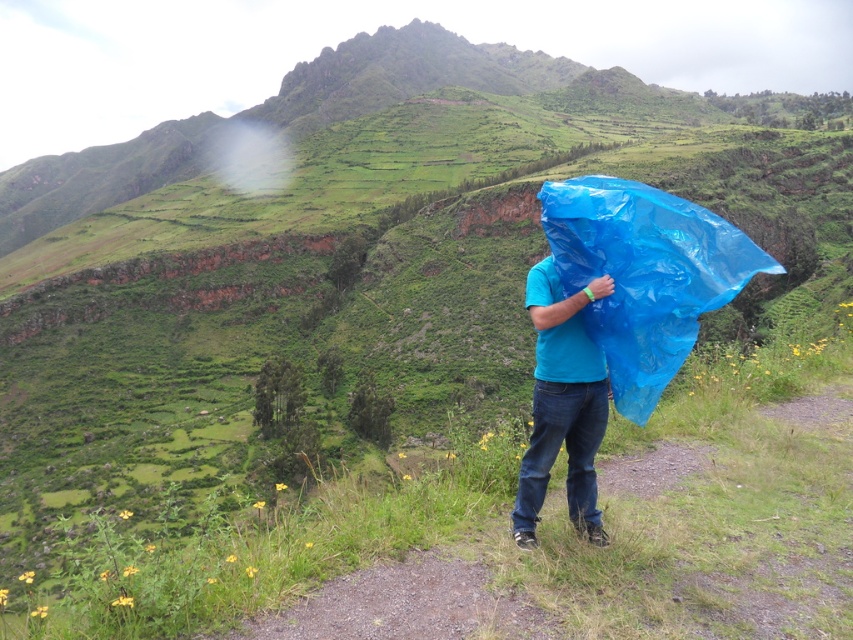
You are standing at the point marked by coordinates point (643,275). What object is located at this point?

The point (643,275) marks the blue plastic bag at center.

You are a photographer trying to capture the scenic outdoor setting. You notice the blue plastic bag at center and the blue matte plastic bag at center in the image. Which one is positioned higher in the frame?

The blue plastic bag at center is positioned higher than the blue matte plastic bag at center in the frame.